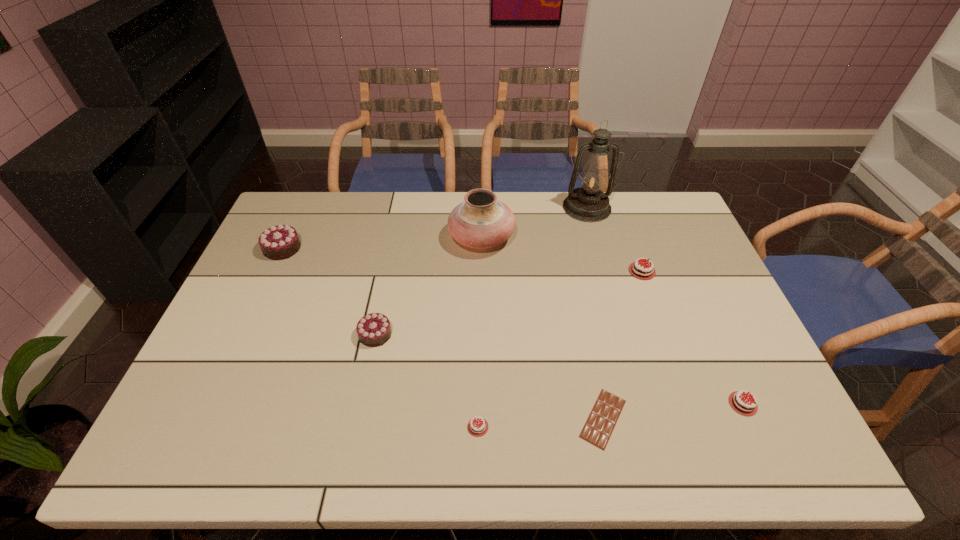
Locate an element on the screen. The image size is (960, 540). vacant region at the right edge of the desktop is located at coordinates (724, 328).

I want to click on free space at the far left corner of the desktop, so click(324, 198).

This screenshot has height=540, width=960. I want to click on vacant region at the far right corner, so click(x=671, y=192).

The height and width of the screenshot is (540, 960). I want to click on vacant area that lies between the oil lamp and the chocolate bar, so click(x=595, y=313).

At what (x,y) coordinates should I click in order to perform the action: click on vacant space in between the tallest object and the third tallest chocolate cake. Please return your answer as a coordinate pair (x, y). Looking at the image, I should click on (614, 239).

At what (x,y) coordinates should I click in order to perform the action: click on empty location between the seventh shortest object and the oil lamp. Please return your answer as a coordinate pair (x, y). Image resolution: width=960 pixels, height=540 pixels. Looking at the image, I should click on (534, 222).

At what (x,y) coordinates should I click in order to perform the action: click on free spot between the fourth tallest chocolate cake and the chocolate bar. Please return your answer as a coordinate pair (x, y). The height and width of the screenshot is (540, 960). Looking at the image, I should click on (673, 411).

Image resolution: width=960 pixels, height=540 pixels. In order to click on vacant area that lies between the shortest object and the sixth tallest object in this screenshot , I will do `click(673, 411)`.

Where is `vacant area between the shortest chocolate cake and the tallest object`? vacant area between the shortest chocolate cake and the tallest object is located at coordinates (533, 317).

The width and height of the screenshot is (960, 540). Identify the location of vacant area that lies between the third farthest chocolate cake and the farthest red chocolate cake. (509, 303).